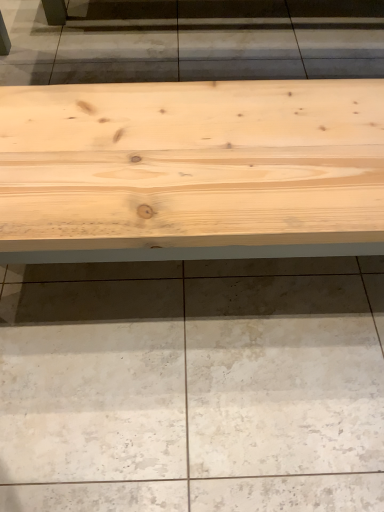
Question: From the image's perspective, is natural wood bench at center above or below natural wood table at center?

Choices:
 (A) above
 (B) below

Answer: (B)

Question: From a real-world perspective, is natural wood bench at center positioned above or below natural wood table at center?

Choices:
 (A) below
 (B) above

Answer: (A)

Question: In terms of height, does natural wood bench at center look taller or shorter compared to natural wood table at center?

Choices:
 (A) tall
 (B) short

Answer: (B)

Question: Is natural wood table at center inside or outside of natural wood bench at center?

Choices:
 (A) inside
 (B) outside

Answer: (B)

Question: In terms of size, does natural wood table at center appear bigger or smaller than natural wood bench at center?

Choices:
 (A) small
 (B) big

Answer: (B)

Question: Would you say natural wood table at center is to the left or to the right of natural wood bench at center in the picture?

Choices:
 (A) right
 (B) left

Answer: (B)

Question: Considering the positions of natural wood table at center and natural wood bench at center in the image, is natural wood table at center taller or shorter than natural wood bench at center?

Choices:
 (A) short
 (B) tall

Answer: (B)